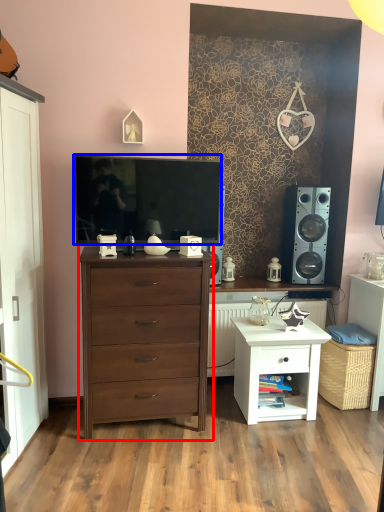
Question: Among these objects, which one is farthest to the camera, chest of drawers (highlighted by a red box) or television (highlighted by a blue box)?

Choices:
 (A) chest of drawers
 (B) television

Answer: (B)